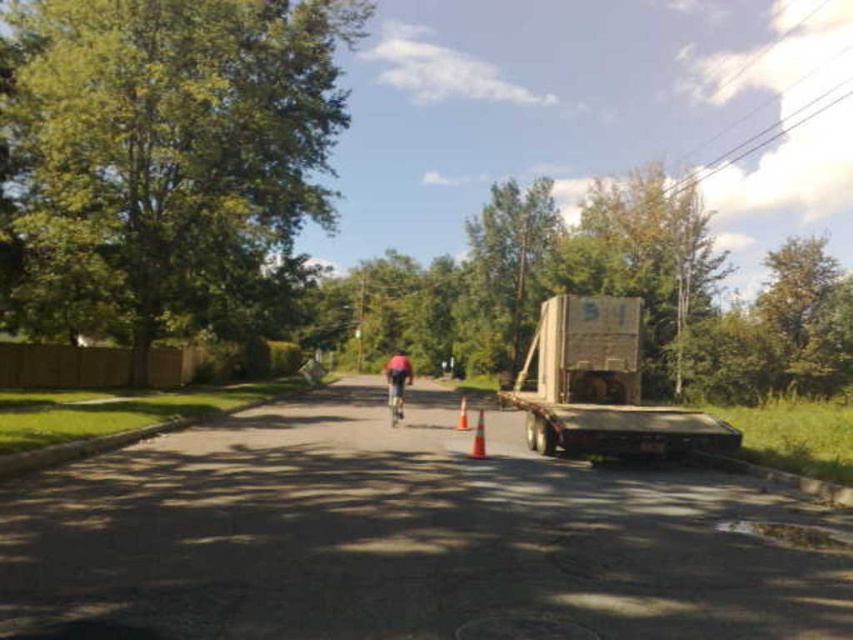
You are driving a car and see the wooden crate at right and the orange matte traffic cone at center on the road. Which object is higher up in the image?

The wooden crate at right is located above the orange matte traffic cone at center in the image.

You are a delivery person who needs to pass the shiny metallic bicycle at center on the road. The wooden crate at right is blocking the path. Can you safely go around it on the right side of the road?

The wooden crate at right is taller than the shiny metallic bicycle at center, but the height does not affect the ability to go around it. Since the wooden crate at right is blocking the path, you can safely go around it on the right side of the road as the road is bordered by trees and shrubs on the right, providing enough space.

You are a delivery person trying to park your delivery van on the right side of the road. The van is 2 meters wide. There is a wooden crate at right and an orange matte traffic cone at center. Can you park your van between them without hitting either?

The wooden crate at right is 1.96 meters from the orange matte traffic cone at center. Since the van is 2 meters wide, it is slightly wider than the space between them. Therefore, you cannot park the van between the wooden crate at right and the orange matte traffic cone at center without hitting one of them.